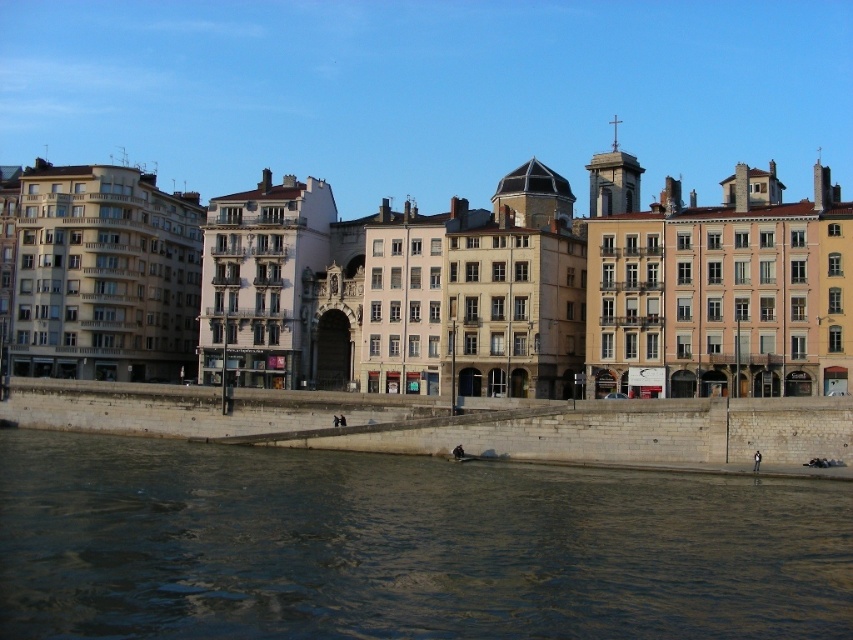
Question: Does dark water at lower center have a larger size compared to stone embankment at lower center?

Choices:
 (A) no
 (B) yes

Answer: (B)

Question: Which point is closer to the camera?

Choices:
 (A) (579, 416)
 (B) (337, 472)

Answer: (B)

Question: Is dark water at lower center below stone embankment at lower center?

Choices:
 (A) yes
 (B) no

Answer: (A)

Question: Is the position of dark water at lower center more distant than that of stone embankment at lower center?

Choices:
 (A) no
 (B) yes

Answer: (A)